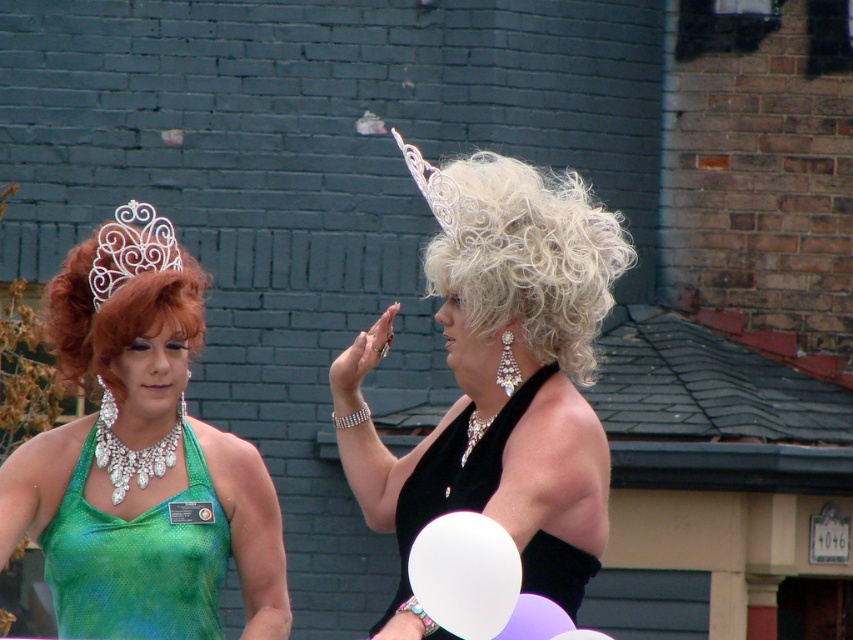
Question: Which object appears closest to the camera in this image?

Choices:
 (A) green sequined dress at left
 (B) sparkling diamond necklace at center

Answer: (A)

Question: Which point appears farthest from the camera in this image?

Choices:
 (A) (444, 248)
 (B) (138, 264)
 (C) (490, 481)
 (D) (473, 422)

Answer: (B)

Question: In this image, where is black satin dress at center located relative to white matte balloon at lower center?

Choices:
 (A) right
 (B) left

Answer: (A)

Question: Does black satin dress at center come behind purple translucent balloon at center?

Choices:
 (A) no
 (B) yes

Answer: (B)

Question: Can you confirm if white matte balloon at lower center is positioned below purple matte balloon at center?

Choices:
 (A) no
 (B) yes

Answer: (A)

Question: Which point appears farthest from the camera in this image?

Choices:
 (A) (503, 403)
 (B) (576, 224)
 (C) (477, 547)

Answer: (A)